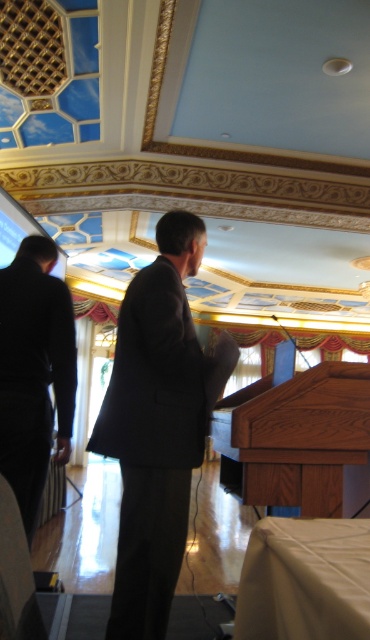
Question: Estimate the real-world distances between objects in this image. Which object is closer to the black fabric suit at left?

Choices:
 (A) brown wood podium at center
 (B) dark gray suit at center

Answer: (B)

Question: Does brown wood podium at center have a larger size compared to black fabric suit at left?

Choices:
 (A) yes
 (B) no

Answer: (A)

Question: Can you confirm if dark gray suit at center is smaller than black fabric suit at left?

Choices:
 (A) no
 (B) yes

Answer: (A)

Question: Is brown wood podium at center above black fabric suit at left?

Choices:
 (A) no
 (B) yes

Answer: (A)

Question: Estimate the real-world distances between objects in this image. Which object is farther from the black fabric suit at left?

Choices:
 (A) brown wood podium at center
 (B) dark gray suit at center

Answer: (A)

Question: Among these points, which one is farthest from the camera?

Choices:
 (A) (38, 259)
 (B) (311, 461)
 (C) (190, 376)

Answer: (A)